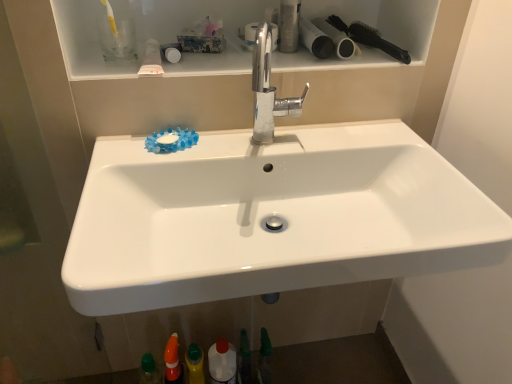
Question: Is white glossy bottle at lower center at the right side of green matte bottle at lower center, arranged as the third toiletry when viewed from the right?

Choices:
 (A) yes
 (B) no

Answer: (B)

Question: Is white glossy bottle at lower center smaller than green matte bottle at lower center, which appears as the 3th toiletry when viewed from the left?

Choices:
 (A) no
 (B) yes

Answer: (A)

Question: From the image's perspective, is white glossy bottle at lower center located above green matte bottle at lower center, which appears as the 3th toiletry when viewed from the left?

Choices:
 (A) no
 (B) yes

Answer: (A)

Question: From the image's perspective, does white glossy bottle at lower center appear lower than green matte bottle at lower center, which appears as the 3th toiletry when viewed from the left?

Choices:
 (A) yes
 (B) no

Answer: (A)

Question: Can you confirm if white glossy bottle at lower center is bigger than green matte bottle at lower center, which ranks as the 3th toiletry in bottom-to-top order?

Choices:
 (A) yes
 (B) no

Answer: (A)

Question: In terms of size, does white glossy sink at center appear bigger or smaller than yellow matte bottle at lower center, the fifth toiletry when ordered from top to bottom?

Choices:
 (A) big
 (B) small

Answer: (A)

Question: Is point (355, 218) closer or farther from the camera than point (194, 377)?

Choices:
 (A) closer
 (B) farther

Answer: (A)

Question: Would you say white glossy sink at center is to the left or to the right of yellow matte bottle at lower center, the fourth toiletry when ordered from right to left, in the picture?

Choices:
 (A) right
 (B) left

Answer: (A)

Question: Is white glossy sink at center situated inside yellow matte bottle at lower center, the fourth toiletry when ordered from right to left, or outside?

Choices:
 (A) outside
 (B) inside

Answer: (A)

Question: Considering their positions, is chrome metallic faucet at center located in front of or behind matte white toilet paper at upper right, the 1th toilet paper viewed from the left?

Choices:
 (A) front
 (B) behind

Answer: (A)

Question: Considering the relative positions of chrome metallic faucet at center and matte white toilet paper at upper right, which is counted as the 2th toilet paper, starting from the right, in the image provided, is chrome metallic faucet at center to the left or to the right of matte white toilet paper at upper right, which is counted as the 2th toilet paper, starting from the right,?

Choices:
 (A) right
 (B) left

Answer: (B)

Question: Would you say chrome metallic faucet at center is inside or outside matte white toilet paper at upper right, which is counted as the 2th toilet paper, starting from the right?

Choices:
 (A) inside
 (B) outside

Answer: (B)

Question: Is point (257, 64) positioned closer to the camera than point (302, 36)?

Choices:
 (A) closer
 (B) farther

Answer: (A)

Question: Visually, is black plastic brush at upper right positioned to the left or to the right of matte white toilet paper at upper right, the 1th toilet paper viewed from the left?

Choices:
 (A) left
 (B) right

Answer: (B)

Question: From the image's perspective, is black plastic brush at upper right located above or below matte white toilet paper at upper right, the 1th toilet paper viewed from the left?

Choices:
 (A) above
 (B) below

Answer: (A)